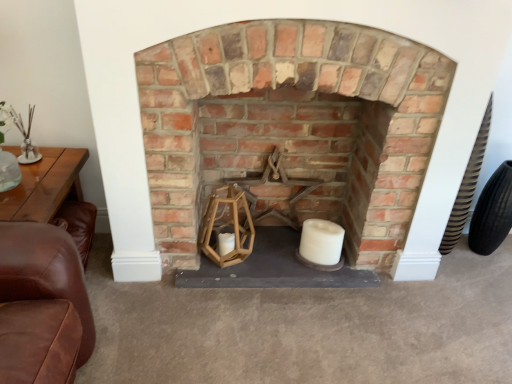
Question: Considering the relative positions of white matte candle at center and rustic brick fireplace at center in the image provided, is white matte candle at center to the left of rustic brick fireplace at center from the viewer's perspective?

Choices:
 (A) yes
 (B) no

Answer: (B)

Question: From the image's perspective, is white matte candle at center below rustic brick fireplace at center?

Choices:
 (A) no
 (B) yes

Answer: (B)

Question: Can you confirm if white matte candle at center is thinner than rustic brick fireplace at center?

Choices:
 (A) yes
 (B) no

Answer: (A)

Question: Does white matte candle at center have a lesser height compared to rustic brick fireplace at center?

Choices:
 (A) no
 (B) yes

Answer: (B)

Question: Is white matte candle at center far away from rustic brick fireplace at center?

Choices:
 (A) yes
 (B) no

Answer: (B)

Question: From a real-world perspective, is white matte candle at center above or below black rubber tire at right?

Choices:
 (A) below
 (B) above

Answer: (A)

Question: Based on their positions, is white matte candle at center located to the left or right of black rubber tire at right?

Choices:
 (A) left
 (B) right

Answer: (A)

Question: Considering the positions of white matte candle at center and black rubber tire at right in the image, is white matte candle at center taller or shorter than black rubber tire at right?

Choices:
 (A) tall
 (B) short

Answer: (B)

Question: From the image's perspective, is white matte candle at center above or below black rubber tire at right?

Choices:
 (A) above
 (B) below

Answer: (B)

Question: Considering the positions of black rubber tire at right and white matte candle at center in the image, is black rubber tire at right wider or thinner than white matte candle at center?

Choices:
 (A) thin
 (B) wide

Answer: (A)

Question: Considering the relative positions of black rubber tire at right and white matte candle at center in the image provided, is black rubber tire at right to the left or to the right of white matte candle at center?

Choices:
 (A) left
 (B) right

Answer: (B)

Question: Based on their sizes in the image, would you say black rubber tire at right is bigger or smaller than white matte candle at center?

Choices:
 (A) small
 (B) big

Answer: (B)

Question: From a real-world perspective, is black rubber tire at right physically located above or below white matte candle at center?

Choices:
 (A) above
 (B) below

Answer: (A)

Question: In terms of size, does rustic brick fireplace at center appear bigger or smaller than black rubber tire at right?

Choices:
 (A) small
 (B) big

Answer: (B)

Question: Considering the positions of rustic brick fireplace at center and black rubber tire at right in the image, is rustic brick fireplace at center taller or shorter than black rubber tire at right?

Choices:
 (A) short
 (B) tall

Answer: (B)